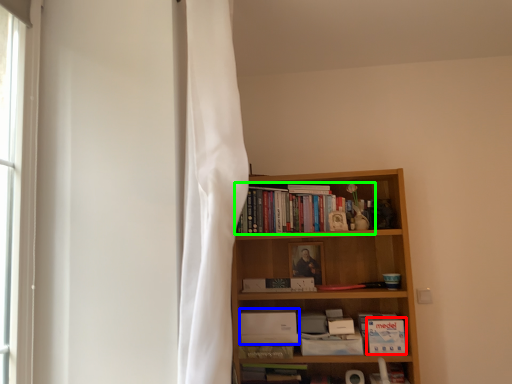
Question: Considering the real-world distances, which object is closest to paperback book (highlighted by a red box)? paperback book (highlighted by a blue box) or book (highlighted by a green box).

Choices:
 (A) paperback book
 (B) book

Answer: (A)